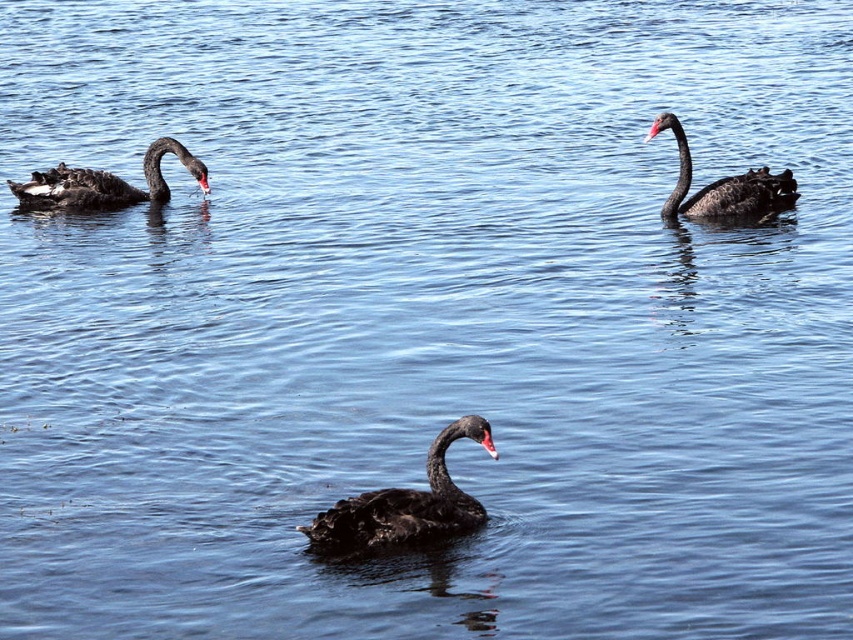
Question: Which of the following is the closest to the observer?

Choices:
 (A) matte black swan at upper right
 (B) matte black swan at center
 (C) matte black swan at left

Answer: (B)

Question: Which point is farther to the camera?

Choices:
 (A) (439, 458)
 (B) (791, 179)
 (C) (163, 188)

Answer: (C)

Question: Is matte black swan at center above matte black swan at left?

Choices:
 (A) no
 (B) yes

Answer: (A)

Question: Which object is closer to the camera taking this photo?

Choices:
 (A) matte black swan at left
 (B) matte black swan at center
 (C) matte black swan at upper right

Answer: (B)

Question: Does matte black swan at center have a smaller size compared to matte black swan at upper right?

Choices:
 (A) yes
 (B) no

Answer: (A)

Question: Can you confirm if matte black swan at center is positioned above matte black swan at upper right?

Choices:
 (A) no
 (B) yes

Answer: (A)